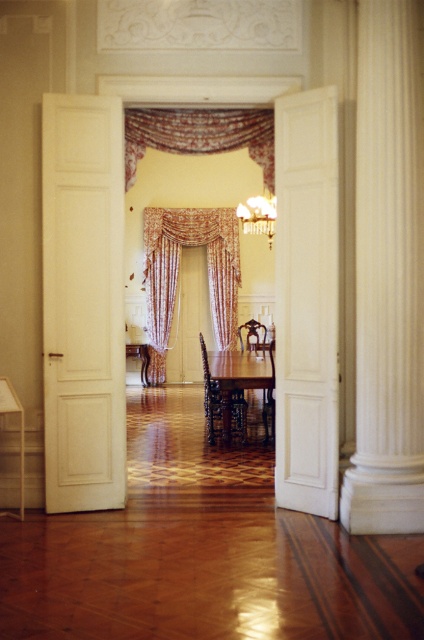
Question: Does wooden chair at center appear under gold metallic chandelier at center?

Choices:
 (A) no
 (B) yes

Answer: (B)

Question: Among these points, which one is nearest to the camera?

Choices:
 (A) click(x=133, y=141)
 (B) click(x=262, y=342)
 (C) click(x=370, y=333)

Answer: (C)

Question: Can you confirm if gold metallic chandelier at center is positioned to the right of mahogany wood chair at center?

Choices:
 (A) yes
 (B) no

Answer: (A)

Question: Which is nearer to the mahogany wood chair at center?

Choices:
 (A) patterned fabric curtain at center
 (B) floral fabric curtain at center
 (C) wooden chair at center

Answer: (B)

Question: Where is floral fabric curtain at center located in relation to wooden chair at center in the image?

Choices:
 (A) below
 (B) above

Answer: (B)

Question: Which object appears farthest from the camera in this image?

Choices:
 (A) white marble column at center
 (B) gold metallic chandelier at center

Answer: (B)